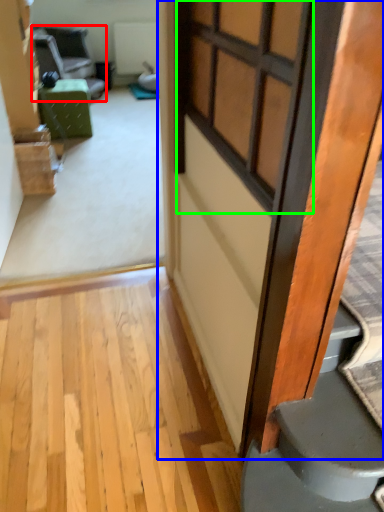
Question: Which is nearer to the chair (highlighted by a red box)? door (highlighted by a blue box) or window (highlighted by a green box).

Choices:
 (A) door
 (B) window

Answer: (B)